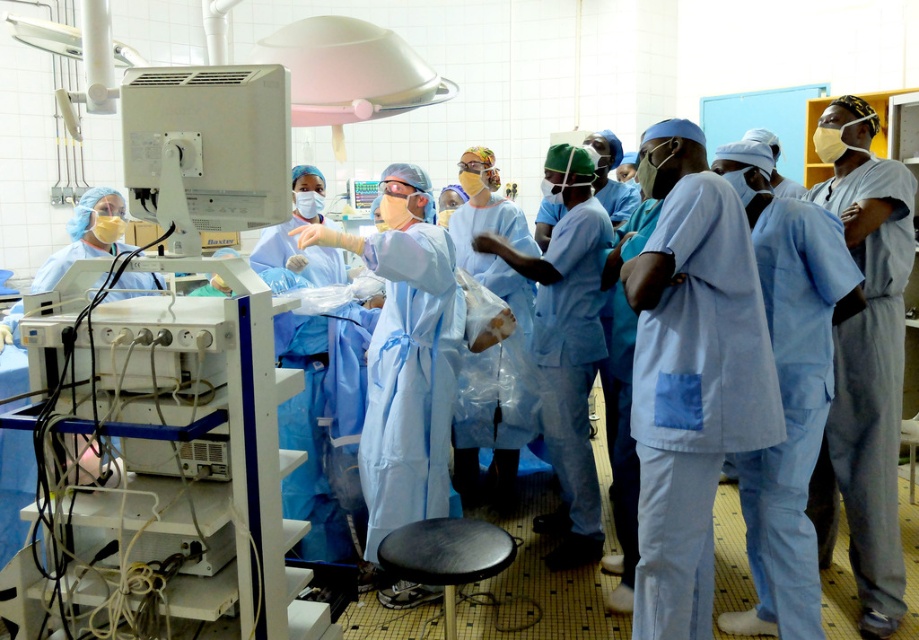
You are a medical student observing the surgical team in the operating theater. You notice a point marked at coordinates (691, 374). What color scrubs are located at that specific point?

The light blue scrubs at center are located at point (691, 374).